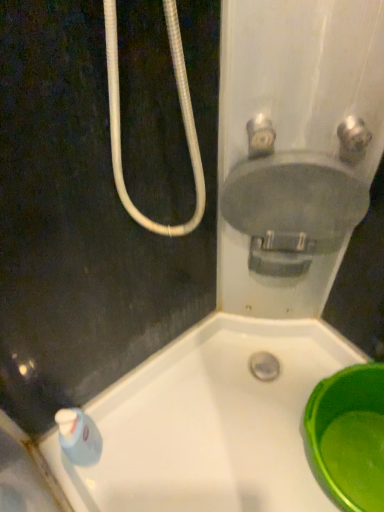
Question: Considering the relative positions of green plastic basin at lower right and matte gray valve at upper right, which ranks as the 1th plumbing fixture in left-to-right order, in the image provided, is green plastic basin at lower right behind matte gray valve at upper right, which ranks as the 1th plumbing fixture in left-to-right order,?

Choices:
 (A) no
 (B) yes

Answer: (B)

Question: From a real-world perspective, is green plastic basin at lower right over matte gray valve at upper right, acting as the second plumbing fixture starting from the right?

Choices:
 (A) yes
 (B) no

Answer: (B)

Question: From the image's perspective, is green plastic basin at lower right located beneath matte gray valve at upper right, which ranks as the 1th plumbing fixture in left-to-right order?

Choices:
 (A) yes
 (B) no

Answer: (A)

Question: Is green plastic basin at lower right turned away from matte gray valve at upper right, acting as the second plumbing fixture starting from the right?

Choices:
 (A) yes
 (B) no

Answer: (B)

Question: Considering the relative positions of green plastic basin at lower right and matte gray valve at upper right, acting as the second plumbing fixture starting from the right, in the image provided, is green plastic basin at lower right to the left of matte gray valve at upper right, acting as the second plumbing fixture starting from the right, from the viewer's perspective?

Choices:
 (A) yes
 (B) no

Answer: (B)

Question: From the image's perspective, is satin nickel faucet at upper right, the first plumbing fixture in the right-to-left sequence, above or below matte gray valve at upper right, which ranks as the 1th plumbing fixture in left-to-right order?

Choices:
 (A) below
 (B) above

Answer: (A)

Question: From their relative heights in the image, would you say satin nickel faucet at upper right, which is the second plumbing fixture in left-to-right order, is taller or shorter than matte gray valve at upper right, which ranks as the 1th plumbing fixture in left-to-right order?

Choices:
 (A) short
 (B) tall

Answer: (B)

Question: Is satin nickel faucet at upper right, which is the second plumbing fixture in left-to-right order, in front of or behind matte gray valve at upper right, which ranks as the 1th plumbing fixture in left-to-right order, in the image?

Choices:
 (A) front
 (B) behind

Answer: (A)

Question: From a real-world perspective, is satin nickel faucet at upper right, which is the second plumbing fixture in left-to-right order, positioned above or below matte gray valve at upper right, acting as the second plumbing fixture starting from the right?

Choices:
 (A) above
 (B) below

Answer: (A)

Question: Is matte gray sink at upper right in front of or behind matte gray valve at upper right, acting as the second plumbing fixture starting from the right, in the image?

Choices:
 (A) front
 (B) behind

Answer: (B)

Question: From their relative heights in the image, would you say matte gray sink at upper right is taller or shorter than matte gray valve at upper right, which ranks as the 1th plumbing fixture in left-to-right order?

Choices:
 (A) tall
 (B) short

Answer: (A)

Question: From the image's perspective, relative to matte gray valve at upper right, which ranks as the 1th plumbing fixture in left-to-right order, is matte gray sink at upper right above or below?

Choices:
 (A) below
 (B) above

Answer: (A)

Question: Looking at the image, does matte gray sink at upper right seem bigger or smaller compared to matte gray valve at upper right, which ranks as the 1th plumbing fixture in left-to-right order?

Choices:
 (A) big
 (B) small

Answer: (A)

Question: In terms of width, does matte gray sink at upper right look wider or thinner when compared to satin nickel faucet at upper right, which is the second plumbing fixture in left-to-right order?

Choices:
 (A) wide
 (B) thin

Answer: (A)

Question: From their relative heights in the image, would you say matte gray sink at upper right is taller or shorter than satin nickel faucet at upper right, the first plumbing fixture in the right-to-left sequence?

Choices:
 (A) short
 (B) tall

Answer: (B)